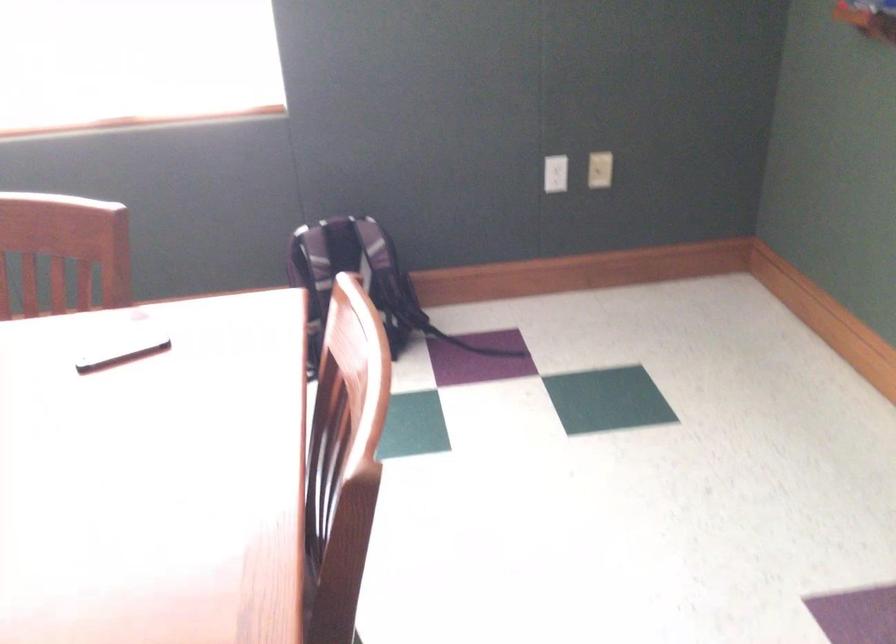
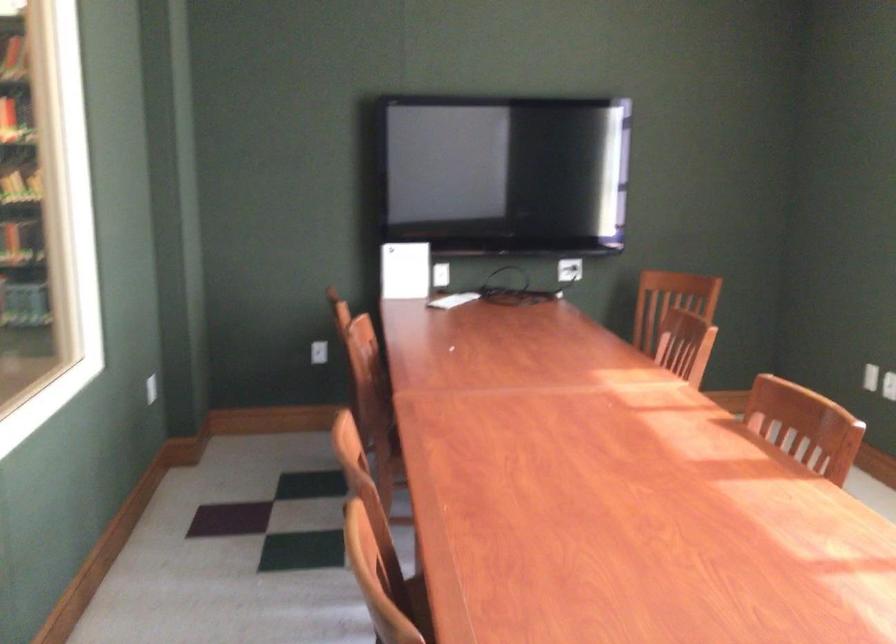
Question: How did the camera likely rotate?

Choices:
 (A) Left
 (B) Right
 (C) Up
 (D) Down

Answer: (A)